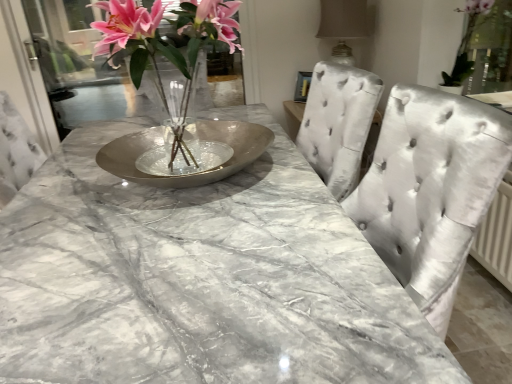
Question: Can you confirm if satin silver chair at center is smaller than transparent glass door at upper left?

Choices:
 (A) yes
 (B) no

Answer: (A)

Question: Is satin silver chair at center touching transparent glass door at upper left?

Choices:
 (A) yes
 (B) no

Answer: (B)

Question: Does satin silver chair at center lie in front of transparent glass door at upper left?

Choices:
 (A) no
 (B) yes

Answer: (B)

Question: Does satin silver chair at center have a lesser height compared to transparent glass door at upper left?

Choices:
 (A) yes
 (B) no

Answer: (A)

Question: Can transparent glass door at upper left be found inside satin silver chair at center?

Choices:
 (A) yes
 (B) no

Answer: (B)

Question: Does satin silver chair at center have a greater height compared to transparent glass door at upper left?

Choices:
 (A) yes
 (B) no

Answer: (B)

Question: Could you tell me if satin beige lampshade at upper right is facing transparent glass door at upper left?

Choices:
 (A) yes
 (B) no

Answer: (B)

Question: Is satin beige lampshade at upper right bigger than transparent glass door at upper left?

Choices:
 (A) no
 (B) yes

Answer: (A)

Question: Is satin beige lampshade at upper right completely or partially outside of transparent glass door at upper left?

Choices:
 (A) no
 (B) yes

Answer: (B)

Question: Is satin beige lampshade at upper right to the right of transparent glass door at upper left from the viewer's perspective?

Choices:
 (A) yes
 (B) no

Answer: (A)

Question: From the image's perspective, is satin beige lampshade at upper right above transparent glass door at upper left?

Choices:
 (A) no
 (B) yes

Answer: (A)

Question: Is satin beige lampshade at upper right closer to camera compared to transparent glass door at upper left?

Choices:
 (A) no
 (B) yes

Answer: (B)

Question: Is metallic vase at center not close to silver metallic bowl at center?

Choices:
 (A) yes
 (B) no

Answer: (B)